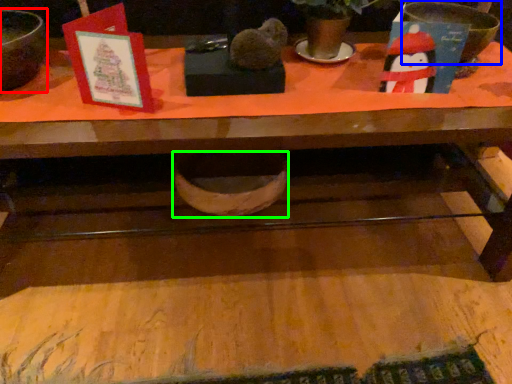
Question: Considering the real-world distances, which object is closest to mixing bowl (highlighted by a red box)? basin (highlighted by a blue box) or basin (highlighted by a green box).

Choices:
 (A) basin
 (B) basin

Answer: (B)